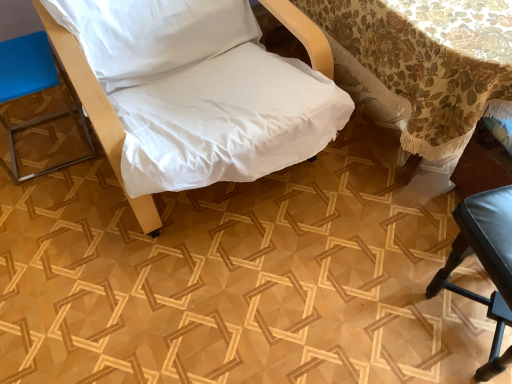
Locate an element on the screen. This screenshot has width=512, height=384. free spot behind black leather chair at lower right, which is the 1th furniture from right to left is located at coordinates (412, 221).